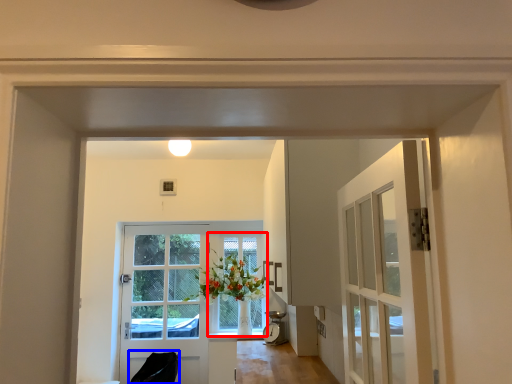
Question: Which point is closer to the camera, window (highlighted by a red box) or chair (highlighted by a blue box)?

Choices:
 (A) window
 (B) chair

Answer: (B)